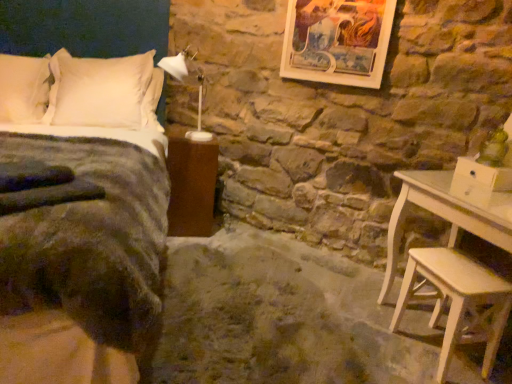
Question: Is velvet dark green bed at left to the left of white plastic lamp at upper center from the viewer's perspective?

Choices:
 (A) yes
 (B) no

Answer: (A)

Question: Can you confirm if velvet dark green bed at left is shorter than white plastic lamp at upper center?

Choices:
 (A) yes
 (B) no

Answer: (B)

Question: Would you say white plastic lamp at upper center is part of velvet dark green bed at left's contents?

Choices:
 (A) no
 (B) yes

Answer: (B)

Question: Is velvet dark green bed at left facing towards white plastic lamp at upper center?

Choices:
 (A) yes
 (B) no

Answer: (B)

Question: From a real-world perspective, is velvet dark green bed at left located higher than white plastic lamp at upper center?

Choices:
 (A) yes
 (B) no

Answer: (B)

Question: From the image's perspective, is white soft pillow at upper left, the 1th pillow from the left, above or below white soft pillow at upper left, the 2th pillow viewed from the left?

Choices:
 (A) above
 (B) below

Answer: (A)

Question: Relative to white soft pillow at upper left, the 1th pillow when ordered from right to left, is white soft pillow at upper left, the second pillow when ordered from right to left, in front or behind?

Choices:
 (A) behind
 (B) front

Answer: (B)

Question: Is white soft pillow at upper left, the 1th pillow from the left, inside the boundaries of white soft pillow at upper left, the 1th pillow when ordered from right to left, or outside?

Choices:
 (A) inside
 (B) outside

Answer: (B)

Question: Considering the positions of white soft pillow at upper left, the second pillow when ordered from right to left, and white soft pillow at upper left, the 2th pillow viewed from the left, in the image, is white soft pillow at upper left, the second pillow when ordered from right to left, wider or thinner than white soft pillow at upper left, the 2th pillow viewed from the left,?

Choices:
 (A) thin
 (B) wide

Answer: (B)

Question: Considering their positions, is white soft pillow at upper left, the 1th pillow from the left, located in front of or behind wooden framed artwork at upper center?

Choices:
 (A) behind
 (B) front

Answer: (A)

Question: Is white soft pillow at upper left, the 1th pillow from the left, to the left or to the right of wooden framed artwork at upper center in the image?

Choices:
 (A) left
 (B) right

Answer: (A)

Question: Considering the positions of white soft pillow at upper left, the second pillow when ordered from right to left, and wooden framed artwork at upper center in the image, is white soft pillow at upper left, the second pillow when ordered from right to left, bigger or smaller than wooden framed artwork at upper center?

Choices:
 (A) small
 (B) big

Answer: (B)

Question: Is white soft pillow at upper left, the second pillow when ordered from right to left, inside or outside of wooden framed artwork at upper center?

Choices:
 (A) outside
 (B) inside

Answer: (A)

Question: Considering the positions of white plastic lamp at upper center and velvet dark green bed at left in the image, is white plastic lamp at upper center taller or shorter than velvet dark green bed at left?

Choices:
 (A) tall
 (B) short

Answer: (B)

Question: Is white plastic lamp at upper center in front of or behind velvet dark green bed at left in the image?

Choices:
 (A) behind
 (B) front

Answer: (A)